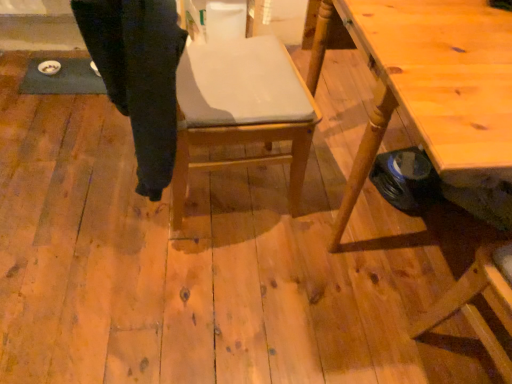
You are a GUI agent. You are given a task and a screenshot of the screen. Output one action in this format:
    pyautogui.click(x=<x>, y=<y>)
    Task: Click on the free space to the left of wooden chair at center
    This screenshot has width=512, height=384.
    Given the screenshot: What is the action you would take?
    pyautogui.click(x=88, y=192)